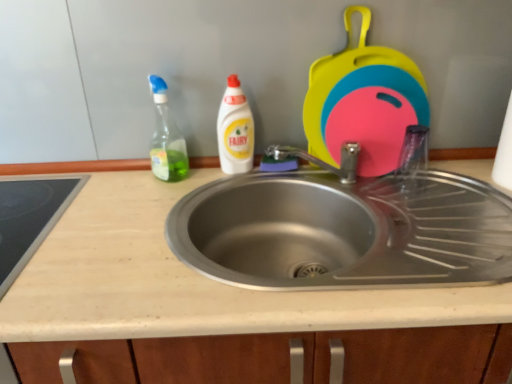
Question: Is beige laminate countertop at center facing away from white glossy bottle at center, the 2th cleaning product in the left-to-right sequence?

Choices:
 (A) yes
 (B) no

Answer: (B)

Question: Is white glossy bottle at center, the 2th cleaning product in the left-to-right sequence, surrounded by beige laminate countertop at center?

Choices:
 (A) yes
 (B) no

Answer: (B)

Question: Can you confirm if beige laminate countertop at center is taller than white glossy bottle at center, the 2th cleaning product in the left-to-right sequence?

Choices:
 (A) no
 (B) yes

Answer: (B)

Question: Does beige laminate countertop at center come behind white glossy bottle at center, which appears as the first cleaning product when viewed from the right?

Choices:
 (A) no
 (B) yes

Answer: (A)

Question: From a real-world perspective, is beige laminate countertop at center positioned over white glossy bottle at center, which appears as the first cleaning product when viewed from the right, based on gravity?

Choices:
 (A) yes
 (B) no

Answer: (B)

Question: Is white glossy bottle at center, the 2th cleaning product in the left-to-right sequence, inside the boundaries of smooth glass cooktop at left, the first appliance positioned from the bottom, or outside?

Choices:
 (A) inside
 (B) outside

Answer: (B)

Question: Looking at their shapes, would you say white glossy bottle at center, which appears as the first cleaning product when viewed from the right, is wider or thinner than smooth glass cooktop at left, the 2th appliance viewed from the top?

Choices:
 (A) wide
 (B) thin

Answer: (B)

Question: Is white glossy bottle at center, the 2th cleaning product in the left-to-right sequence, in front of or behind smooth glass cooktop at left, the 1th appliance positioned from the left, in the image?

Choices:
 (A) behind
 (B) front

Answer: (A)

Question: Considering the positions of white glossy bottle at center, the 2th cleaning product in the left-to-right sequence, and smooth glass cooktop at left, the 2th appliance viewed from the right, in the image, is white glossy bottle at center, the 2th cleaning product in the left-to-right sequence, bigger or smaller than smooth glass cooktop at left, the 2th appliance viewed from the right,?

Choices:
 (A) small
 (B) big

Answer: (A)

Question: From their relative heights in the image, would you say rubberized plastic cutting boards at upper right, which is counted as the second appliance, starting from the left, is taller or shorter than translucent plastic spray bottle at left, the first cleaning product when ordered from left to right?

Choices:
 (A) short
 (B) tall

Answer: (B)

Question: Does point (372, 124) appear closer or farther from the camera than point (183, 172)?

Choices:
 (A) farther
 (B) closer

Answer: (B)

Question: Based on their sizes in the image, would you say rubberized plastic cutting boards at upper right, which is counted as the second appliance, starting from the left, is bigger or smaller than translucent plastic spray bottle at left, the first cleaning product when ordered from left to right?

Choices:
 (A) big
 (B) small

Answer: (A)

Question: Do you think rubberized plastic cutting boards at upper right, positioned as the 2th appliance in bottom-to-top order, is within translucent plastic spray bottle at left, the first cleaning product when ordered from left to right, or outside of it?

Choices:
 (A) outside
 (B) inside

Answer: (A)

Question: From the image's perspective, is beige laminate countertop at center above or below translucent plastic spray bottle at left, the second cleaning product from the right?

Choices:
 (A) below
 (B) above

Answer: (A)

Question: Looking at the image, does beige laminate countertop at center seem bigger or smaller compared to translucent plastic spray bottle at left, the first cleaning product when ordered from left to right?

Choices:
 (A) big
 (B) small

Answer: (A)